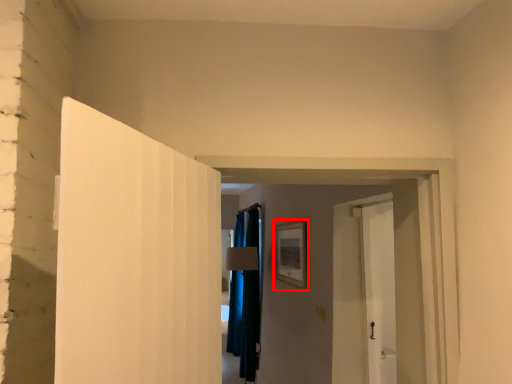
Question: Considering the relative positions of picture frame (annotated by the red box) and curtain in the image provided, where is picture frame (annotated by the red box) located with respect to the staircase?

Choices:
 (A) right
 (B) left

Answer: (A)